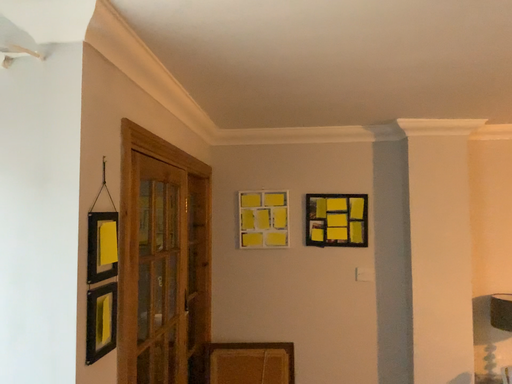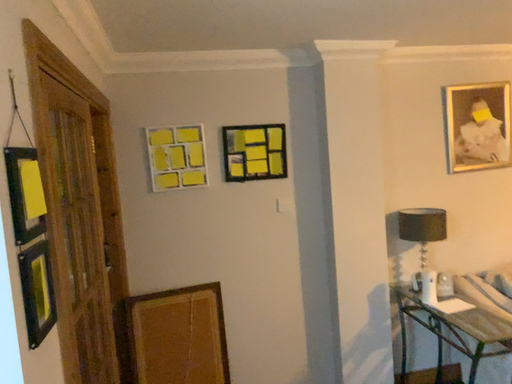
Question: Which way did the camera rotate in the video?

Choices:
 (A) rotated right
 (B) rotated left

Answer: (A)